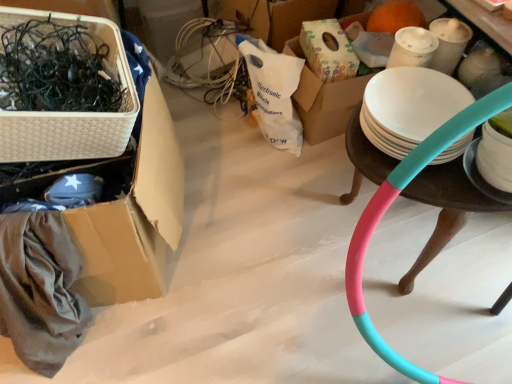
Locate an element on the screen. The height and width of the screenshot is (384, 512). vacant area situated below teal matte hula hoop at right (from a real-world perspective) is located at coordinates (410, 238).